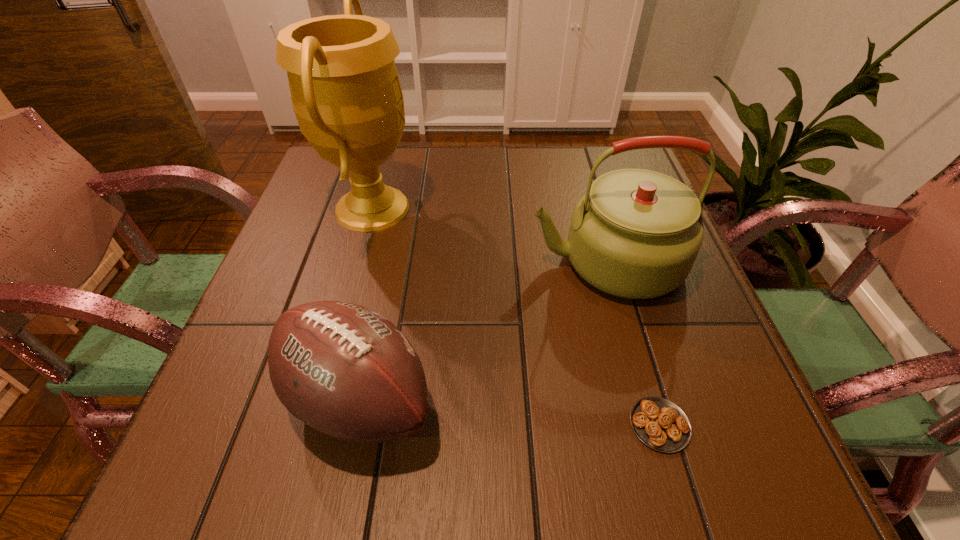
Where is `the tallest object`? The width and height of the screenshot is (960, 540). the tallest object is located at coordinates (346, 95).

Identify the location of the third shortest object. (635, 233).

Find the location of a particular element. This screenshot has height=540, width=960. football (American) is located at coordinates (345, 370).

Find the location of a particular element. pastry is located at coordinates (660, 424).

Where is `vacant space situated on the engravings side of the tallest object`? The height and width of the screenshot is (540, 960). vacant space situated on the engravings side of the tallest object is located at coordinates (507, 208).

At what (x,y) coordinates should I click in order to perform the action: click on free space located at the spout of the kettle. Please return your answer as a coordinate pair (x, y). Looking at the image, I should click on (463, 262).

You are a GUI agent. You are given a task and a screenshot of the screen. Output one action in this format:
    pyautogui.click(x=<x>, y=<y>)
    Task: Click on the blank space located 0.110m at the spout of the kettle
    
    Given the screenshot: What is the action you would take?
    pyautogui.click(x=477, y=262)

Identify the location of vacant space situated 0.180m at the spout of the kettle. [444, 262].

Where is `vacant space located 0.320m on the back of the football (American)`? This screenshot has height=540, width=960. vacant space located 0.320m on the back of the football (American) is located at coordinates (395, 228).

At what (x,y) coordinates should I click in order to perform the action: click on vacant space located 0.380m on the left of the shortest object. Please return your answer as a coordinate pair (x, y). The width and height of the screenshot is (960, 540). Looking at the image, I should click on (381, 425).